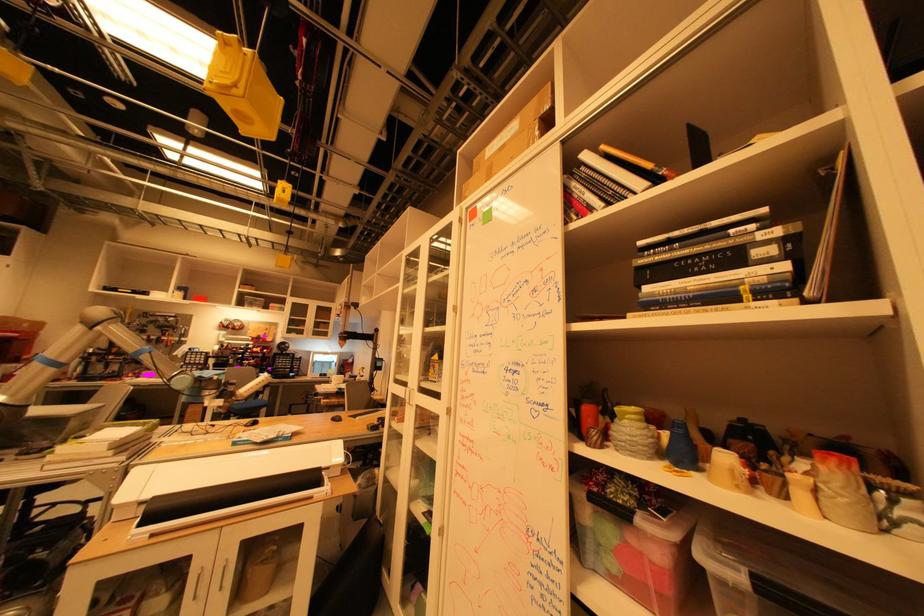
Which object does [681,448] point to?

This point indicates the small blue vase.